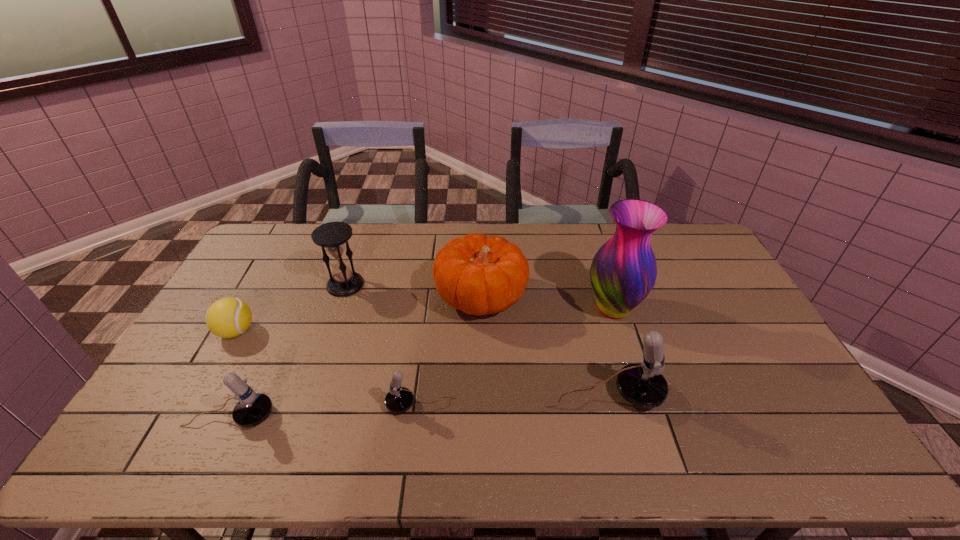
Locate an element on the screen. The width and height of the screenshot is (960, 540). the third shortest object is located at coordinates (253, 408).

At what (x,y) coordinates should I click in order to perform the action: click on the leftmost microphone. Please return your answer as a coordinate pair (x, y). The height and width of the screenshot is (540, 960). Looking at the image, I should click on (253, 408).

I want to click on the shortest microphone, so (399, 399).

The width and height of the screenshot is (960, 540). What are the coordinates of `the rightmost microphone` in the screenshot? It's located at (643, 385).

You are a GUI agent. You are given a task and a screenshot of the screen. Output one action in this format:
    pyautogui.click(x=<x>, y=<y>)
    Task: Click on the hourglass
    The width and height of the screenshot is (960, 540).
    Given the screenshot: What is the action you would take?
    pyautogui.click(x=333, y=237)

Find the location of a particular element. This screenshot has height=540, width=960. pumpkin is located at coordinates (479, 275).

This screenshot has width=960, height=540. What are the coordinates of `vase` in the screenshot? It's located at (623, 272).

Image resolution: width=960 pixels, height=540 pixels. In order to click on tennis ball in this screenshot , I will do `click(229, 317)`.

Where is `vacant space located 0.160m on the back of the second shortest microphone`? The height and width of the screenshot is (540, 960). vacant space located 0.160m on the back of the second shortest microphone is located at coordinates (260, 353).

Image resolution: width=960 pixels, height=540 pixels. Find the location of `vacant region located on the back of the second microphone from left to right`. vacant region located on the back of the second microphone from left to right is located at coordinates (431, 313).